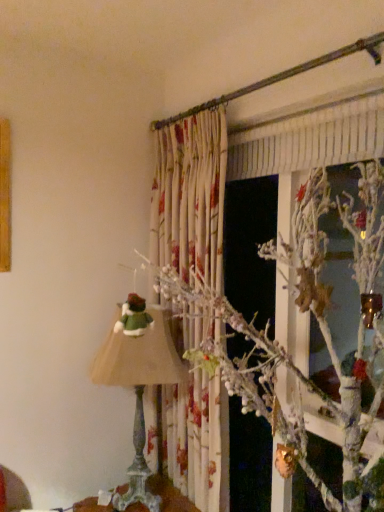
This screenshot has height=512, width=384. Describe the element at coordinates (138, 379) in the screenshot. I see `matte green fabric lampshade at left` at that location.

The width and height of the screenshot is (384, 512). What do you see at coordinates (169, 495) in the screenshot?
I see `wooden table at lower center` at bounding box center [169, 495].

Identify the location of matte green fabric lampshade at left. Image resolution: width=384 pixels, height=512 pixels. (138, 379).

Could you tell me if white frosted branch at upper center is turned towards matte green fabric lampshade at left?

No, white frosted branch at upper center does not turn towards matte green fabric lampshade at left.

Considering the sizes of objects white frosted branch at upper center and matte green fabric lampshade at left in the image provided, who is bigger, white frosted branch at upper center or matte green fabric lampshade at left?

matte green fabric lampshade at left.

Find the location of a particular element. The width and height of the screenshot is (384, 512). branch that is above the matte green fabric lampshade at left (from the image's perspective) is located at coordinates (281, 77).

Is white frosted branch at upper center placed right next to wooden table at lower center?

No, white frosted branch at upper center is not beside wooden table at lower center.

From the image's perspective, between white frosted branch at upper center and wooden table at lower center, which one is located above?

white frosted branch at upper center appears higher in the image.

From a real-world perspective, between white frosted branch at upper center and wooden table at lower center, who is vertically lower?

wooden table at lower center.

Is white frosted branch at upper center at the right side of wooden table at lower center?

Indeed, white frosted branch at upper center is positioned on the right side of wooden table at lower center.

Is matte green fabric lampshade at left smaller than white frosted branch at upper center?

No, matte green fabric lampshade at left is not smaller than white frosted branch at upper center.

Is matte green fabric lampshade at left far away from white frosted branch at upper center?

Yes.

Is matte green fabric lampshade at left looking in the opposite direction of white frosted branch at upper center?

No, matte green fabric lampshade at left is not facing the opposite direction of white frosted branch at upper center.

Locate an element on the screen. furniture below the matte green fabric lampshade at left (from the image's perspective) is located at coordinates [x=169, y=495].

Is matte green fabric lampshade at left facing away from wooden table at lower center?

No, matte green fabric lampshade at left is not facing the opposite direction of wooden table at lower center.

Which object is positioned more to the left, matte green fabric lampshade at left or wooden table at lower center?

wooden table at lower center.

Looking at the image, does wooden table at lower center seem bigger or smaller compared to white frosted branch at upper center?

→ wooden table at lower center is bigger than white frosted branch at upper center.

At what (x,y) coordinates should I click in order to perform the action: click on furniture that is under the white frosted branch at upper center (from a real-world perspective). Please return your answer as a coordinate pair (x, y). The image size is (384, 512). Looking at the image, I should click on (169, 495).

From the picture: Are wooden table at lower center and white frosted branch at upper center far apart?

wooden table at lower center is far away from white frosted branch at upper center.

Does wooden table at lower center appear on the left side of white frosted branch at upper center?

Yes, wooden table at lower center is to the left of white frosted branch at upper center.

Could you tell me if wooden table at lower center is turned towards matte green fabric lampshade at left?

No, wooden table at lower center is not turned towards matte green fabric lampshade at left.

Is wooden table at lower center not near matte green fabric lampshade at left?

No, wooden table at lower center is not far away from matte green fabric lampshade at left.

Which object is closer to the camera taking this photo, wooden table at lower center or matte green fabric lampshade at left?

wooden table at lower center is closer to the camera.

Where is `branch lying above the matte green fabric lampshade at left (from the image's perspective)`? The width and height of the screenshot is (384, 512). branch lying above the matte green fabric lampshade at left (from the image's perspective) is located at coordinates (281, 77).

Locate an element on the screen. furniture that appears on the left of white frosted branch at upper center is located at coordinates (169, 495).

Based on their spatial positions, is wooden table at lower center or white frosted branch at upper center further from matte green fabric lampshade at left?

Among the two, white frosted branch at upper center is located further to matte green fabric lampshade at left.

Consider the image. Based on their spatial positions, is matte green fabric lampshade at left or white frosted branch at upper center further from wooden table at lower center?

white frosted branch at upper center.

Considering their positions, is matte green fabric lampshade at left positioned closer to white frosted branch at upper center than wooden table at lower center?

Based on the image, matte green fabric lampshade at left appears to be nearer to white frosted branch at upper center.

Considering their positions, is wooden table at lower center positioned further to white frosted branch at upper center than matte green fabric lampshade at left?

The object further to white frosted branch at upper center is wooden table at lower center.

From the image, which object appears to be nearer to wooden table at lower center, white frosted branch at upper center or matte green fabric lampshade at left?

matte green fabric lampshade at left.

From the image, which object appears to be nearer to matte green fabric lampshade at left, white frosted branch at upper center or wooden table at lower center?

wooden table at lower center is positioned closer to the anchor matte green fabric lampshade at left.

Find the location of a particular element. This screenshot has height=512, width=384. lamp between white frosted branch at upper center and wooden table at lower center in the up-down direction is located at coordinates (138, 379).